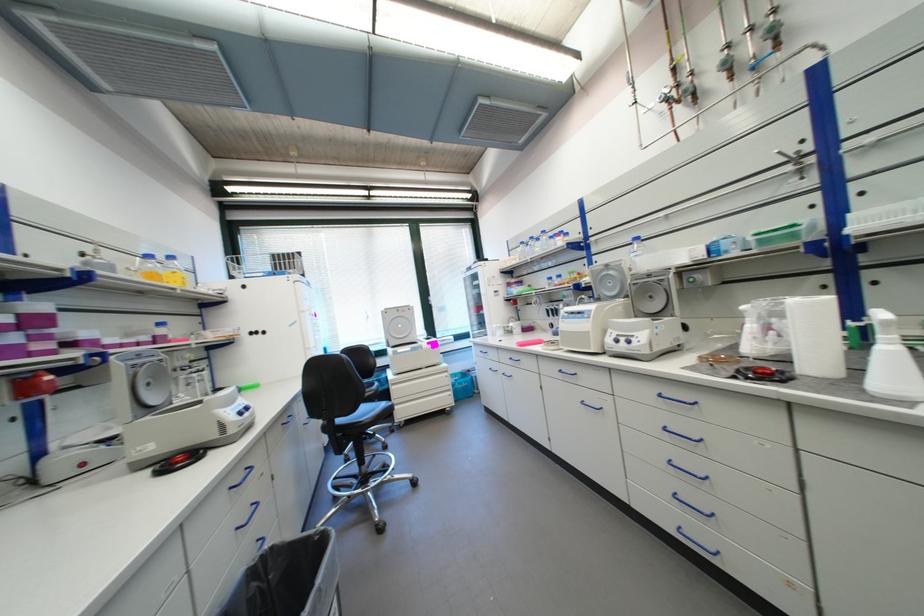
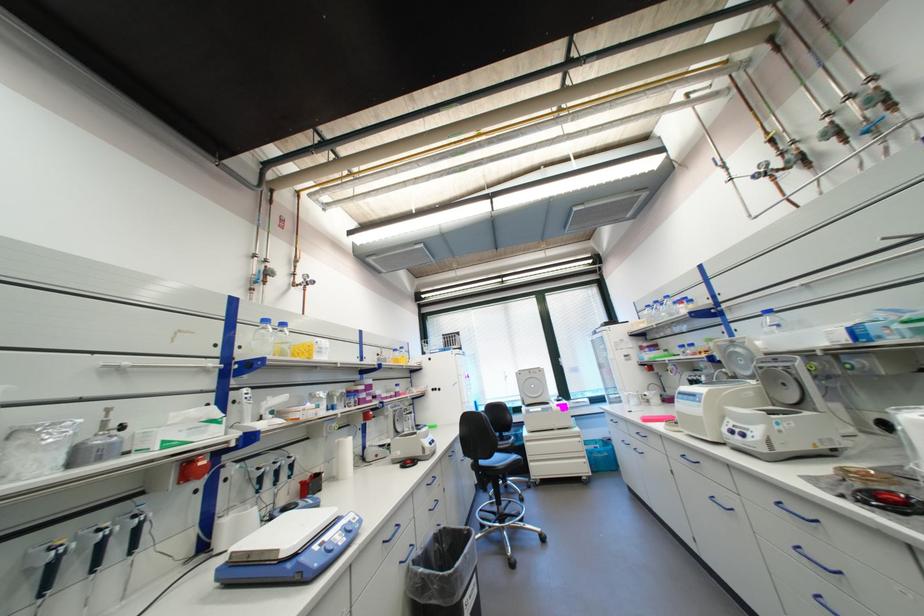
The point at (646, 238) is marked in the first image. Where is the corresponding point in the second image?

(776, 312)